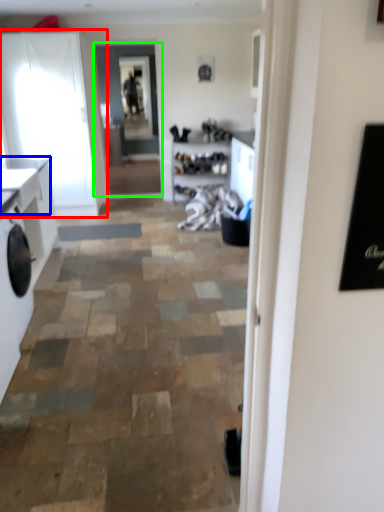
Question: Based on their relative distances, which object is farther from cabinetry (highlighted by a red box)? Choose from counter top (highlighted by a blue box) and glass door (highlighted by a green box).

Choices:
 (A) counter top
 (B) glass door

Answer: (A)